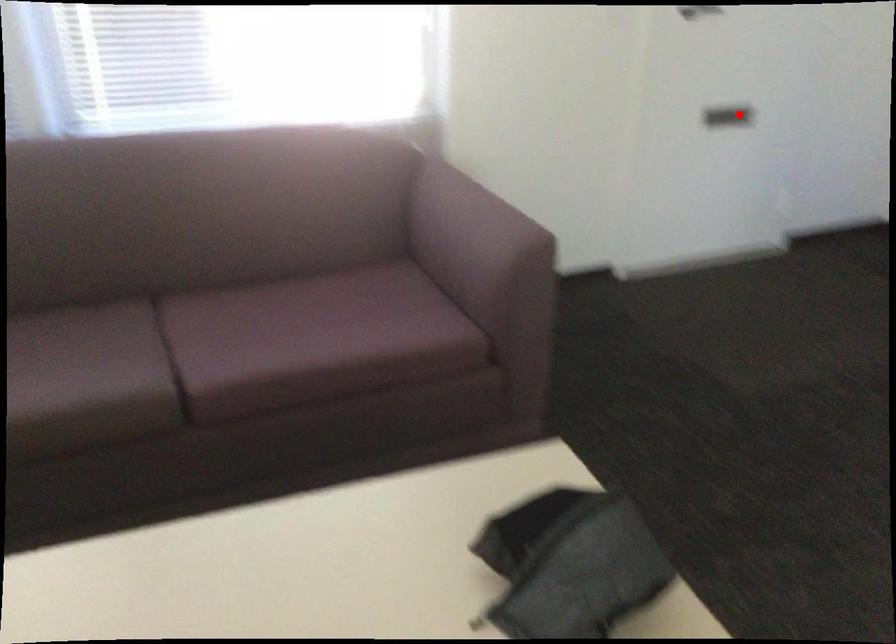
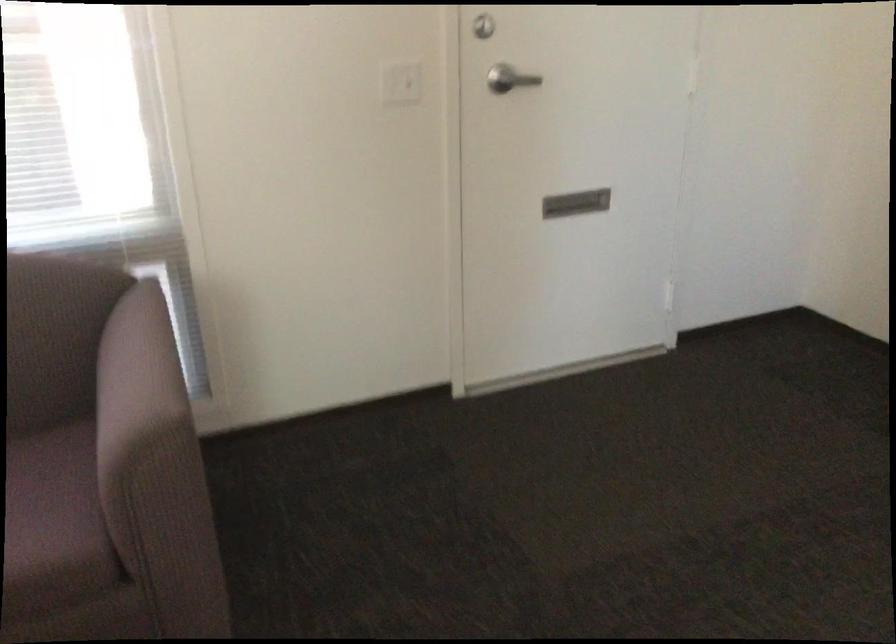
Question: I am providing you with two images of the same scene from different viewpoints. Image1 has a red point marked. In image2, the corresponding 3D location appears at what relative position? Reply with the corresponding letter.

Choices:
 (A) Closer
 (B) Farther

Answer: (A)